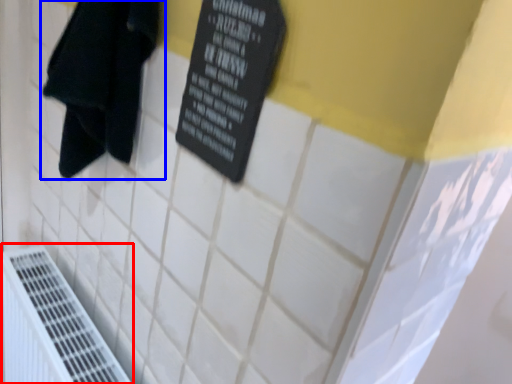
Question: Which point is further to the camera, air conditioning (highlighted by a red box) or towel (highlighted by a blue box)?

Choices:
 (A) air conditioning
 (B) towel

Answer: (A)